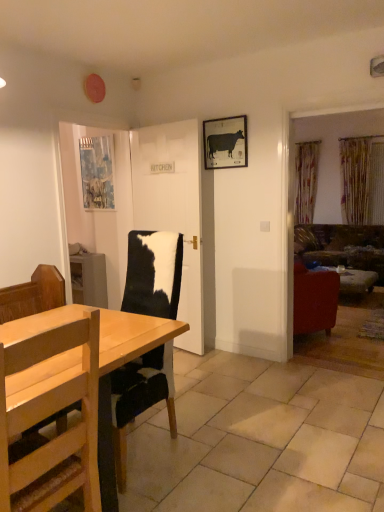
Question: Considering the positions of light wood chair at lower left and blue textured fabric at upper left, positioned as the 1th picture frame in back-to-front order, in the image, is light wood chair at lower left bigger or smaller than blue textured fabric at upper left, positioned as the 1th picture frame in back-to-front order,?

Choices:
 (A) big
 (B) small

Answer: (A)

Question: Relative to blue textured fabric at upper left, positioned as the 1th picture frame in back-to-front order, is light wood chair at lower left in front or behind?

Choices:
 (A) behind
 (B) front

Answer: (B)

Question: Based on their relative distances, which object is farther from the white glossy door at center?

Choices:
 (A) matte black cow at upper center, marked as the 1th picture frame in a right-to-left arrangement
 (B) wooden table at lower right
 (C) blue textured fabric at upper left, the first picture frame when ordered from left to right
 (D) velvet green sofa at right
 (E) gold textured curtain at right

Answer: (E)

Question: Estimate the real-world distances between objects in this image. Which object is closer to the wooden table at lower right?

Choices:
 (A) white glossy door at center
 (B) velvet green sofa at right
 (C) gold textured curtain at right
 (D) light wood chair at lower left
 (E) blue textured fabric at upper left, the first picture frame when ordered from left to right

Answer: (B)